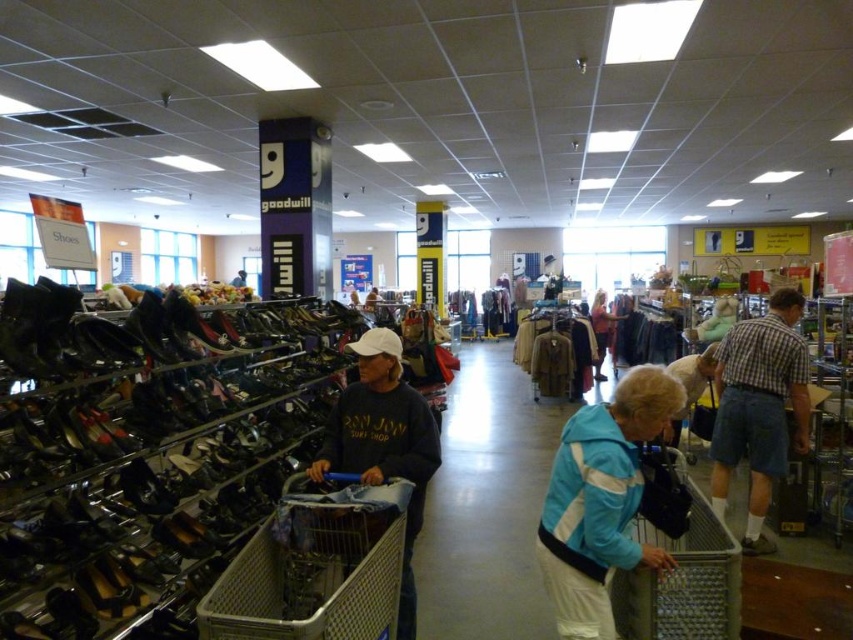
Question: Which point is closer to the camera?

Choices:
 (A) (410, 620)
 (B) (717, 417)

Answer: (A)

Question: Which is nearer to the matte black jacket at center?

Choices:
 (A) metallic silver shopping cart at lower center
 (B) shiny black shoe at lower right
 (C) silver metallic shopping cart at center
 (D) blue fabric jacket at lower right

Answer: (B)

Question: Does silver metallic shopping cart at center have a larger size compared to dark gray sweatshirt at center?

Choices:
 (A) no
 (B) yes

Answer: (A)

Question: Can you confirm if dark gray sweatshirt at center is positioned below metallic silver shopping cart at lower center?

Choices:
 (A) yes
 (B) no

Answer: (B)

Question: Observing the image, what is the correct spatial positioning of silver metallic shopping cart at center in reference to metallic silver shopping cart at lower center?

Choices:
 (A) below
 (B) above

Answer: (A)

Question: Which of the following is the farthest from the observer?

Choices:
 (A) (671, 564)
 (B) (595, 378)

Answer: (B)